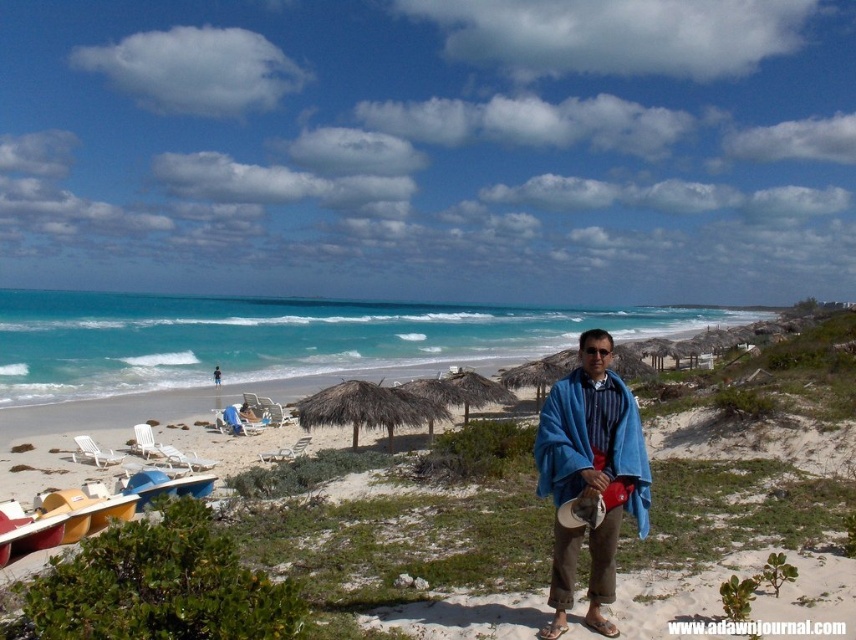
You are a photographer wanting to capture the blue fabric towel at center and the smooth sand beach at center in your shot. Which object appears taller in the photo?

The smooth sand beach at center appears taller than the blue fabric towel at center in the photo because it has a greater height compared to the blue fabric towel at center.